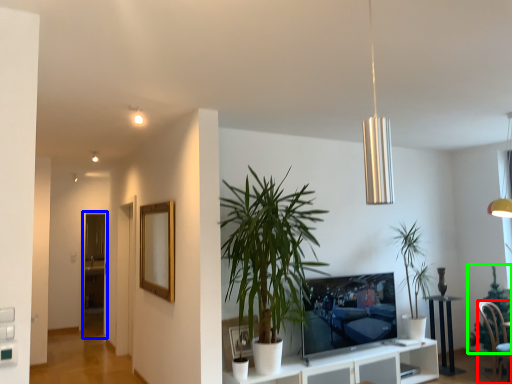
Question: Which is farther away from chair (highlighted by a red box)? glass door (highlighted by a blue box) or houseplant (highlighted by a green box)?

Choices:
 (A) glass door
 (B) houseplant

Answer: (A)